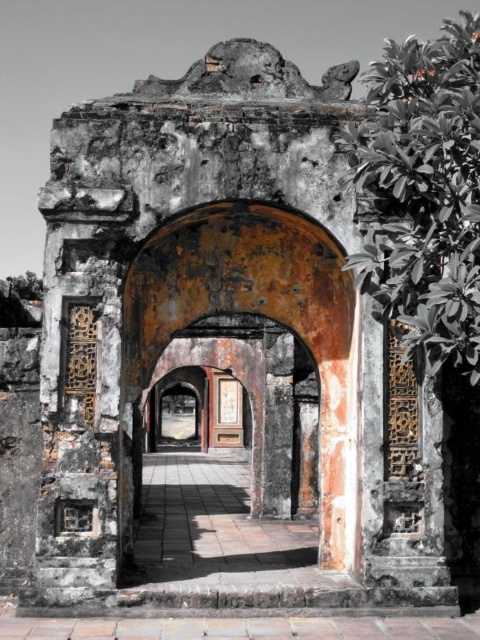
Does green leafy plant at upper right have a larger size compared to rusty metal archway at center?

No, green leafy plant at upper right is not bigger than rusty metal archway at center.

Can you confirm if green leafy plant at upper right is positioned above rusty metal archway at center?

Correct, green leafy plant at upper right is located above rusty metal archway at center.

Does point (416, 108) come behind point (120, 456)?

No, it is in front of (120, 456).

Identify the location of green leafy plant at upper right. (423, 193).